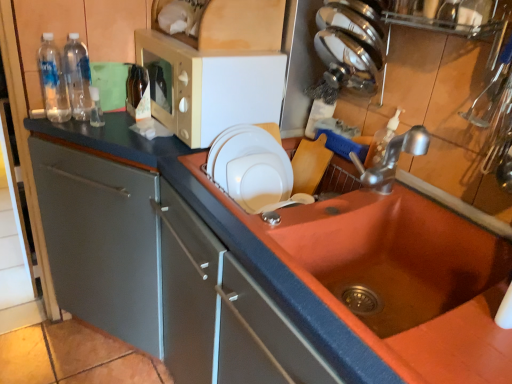
Question: Is point (270, 72) closer or farther from the camera than point (360, 56)?

Choices:
 (A) closer
 (B) farther

Answer: (A)

Question: In the image, is beige plastic microwave at upper center on the left side or the right side of polished stainless steel knives at upper right, the 1th appliance when ordered from top to bottom?

Choices:
 (A) right
 (B) left

Answer: (B)

Question: Considering the real-world distances, which object is farthest from the silver metallic faucet at upper right?

Choices:
 (A) clear plastic bottle at left, which is the second bottle from right to left
 (B) white glossy plate at upper center, which appears as the 1th appliance when ordered from the bottom
 (C) polished stainless steel knives at upper right, the 1th appliance when ordered from top to bottom
 (D) matte orange sink at center
 (E) beige plastic microwave at upper center

Answer: (A)

Question: Which object is positioned closest to the matte orange sink at center?

Choices:
 (A) brown glass bottle at upper left, acting as the 1th bottle starting from the right
 (B) clear plastic bottles at left, the third bottle viewed from the right
 (C) beige plastic microwave at upper center
 (D) clear plastic bottle at left, which is the second bottle from left to right
 (E) matte gray countertop at center

Answer: (E)